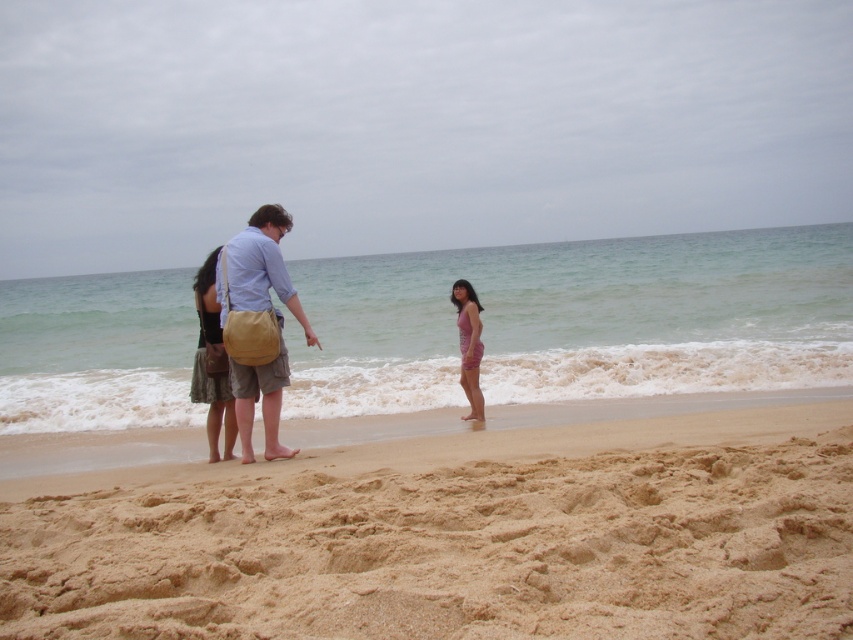
Does light brown canvas bag at center have a larger size compared to black textured dress at center?

Yes, light brown canvas bag at center is bigger than black textured dress at center.

Find the location of a particular element. The width and height of the screenshot is (853, 640). light brown canvas bag at center is located at coordinates (258, 268).

Who is more forward, (247, 380) or (219, 422)?

Point (247, 380)

The image size is (853, 640). In order to click on light brown canvas bag at center in this screenshot , I will do `click(258, 268)`.

Which of these two, light brown canvas bag at center or purple fabric dress at center, stands shorter?

Standing shorter between the two is purple fabric dress at center.

Where is `light brown canvas bag at center`? This screenshot has width=853, height=640. light brown canvas bag at center is located at coordinates (258, 268).

Does point (477, 628) lie in front of point (224, 392)?

Yes, it is in front of point (224, 392).

Between point (688, 508) and point (225, 417), which one is positioned behind?

Point (225, 417)

Locate an element on the screen. fine-grained sand at lower center is located at coordinates (456, 536).

I want to click on fine-grained sand at lower center, so click(x=456, y=536).